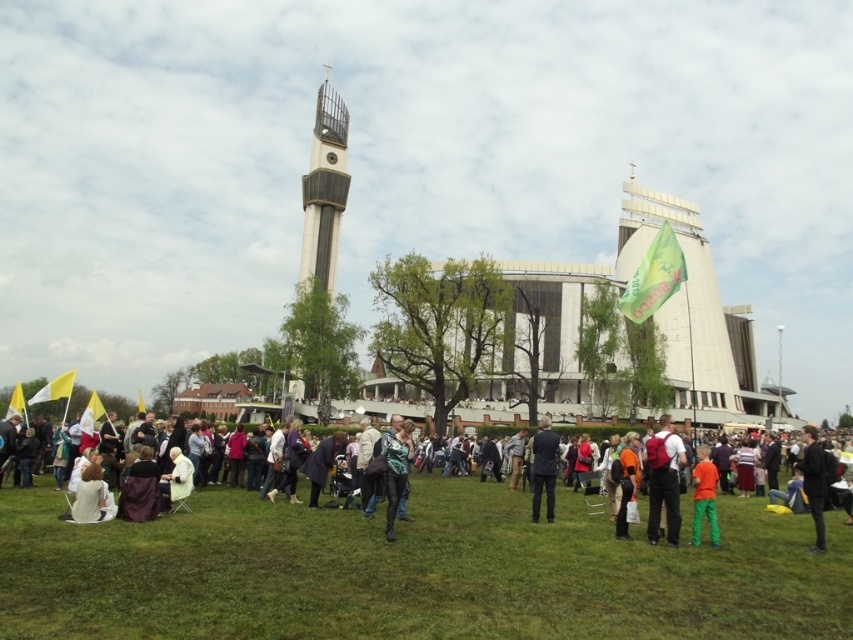
Which is more to the left, green grass at center or orange fabric pants at lower right?

green grass at center is more to the left.

Is green grass at center bigger than orange fabric pants at lower right?

Correct, green grass at center is larger in size than orange fabric pants at lower right.

The width and height of the screenshot is (853, 640). Identify the location of green grass at center. (415, 572).

Where is `green grass at center`? The width and height of the screenshot is (853, 640). green grass at center is located at coordinates tap(415, 572).

Consider the image. Which is more to the left, smooth concrete bell tower at center or dark blue leather jacket at lower right?

From the viewer's perspective, smooth concrete bell tower at center appears more on the left side.

Is the position of smooth concrete bell tower at center less distant than that of dark blue leather jacket at lower right?

No, it is not.

Is point (312, 202) farther from camera compared to point (805, 461)?

Yes.

You are a GUI agent. You are given a task and a screenshot of the screen. Output one action in this format:
    pyautogui.click(x=<x>, y=<y>)
    Task: Click on the smooth concrete bell tower at center
    
    Given the screenshot: What is the action you would take?
    pyautogui.click(x=323, y=189)

Between point (140, 550) and point (328, 291), which one is positioned in front?

Positioned in front is point (140, 550).

Who is higher up, matte black jacket at center or smooth concrete bell tower at center?

smooth concrete bell tower at center

Is point (201, 531) in front of point (341, 163)?

Yes, it is.

I want to click on matte black jacket at center, so click(326, 525).